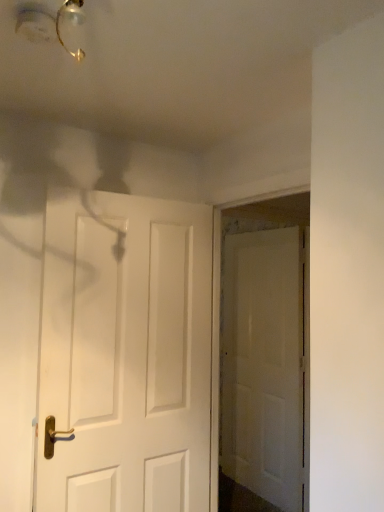
What do you see at coordinates (126, 354) in the screenshot?
I see `white matte door at center, marked as the first door in a front-to-back arrangement` at bounding box center [126, 354].

Where is `white matte door at center, the 2th door from the front`? This screenshot has height=512, width=384. white matte door at center, the 2th door from the front is located at coordinates (263, 365).

Can we say white matte door at center, which is the 1th door in right-to-left order, lies outside matte gold light fixture at upper left?

Yes, white matte door at center, which is the 1th door in right-to-left order, is located beyond the bounds of matte gold light fixture at upper left.

From a real-world perspective, who is located lower, white matte door at center, which is the 1th door in right-to-left order, or matte gold light fixture at upper left?

white matte door at center, which is the 1th door in right-to-left order, is physically lower.

Are white matte door at center, placed as the first door when sorted from back to front, and matte gold light fixture at upper left beside each other?

They are not placed beside each other.

Is matte gold light fixture at upper left at the back of white matte door at center, arranged as the 2th door when viewed from the left?

No, white matte door at center, arranged as the 2th door when viewed from the left, is not facing the opposite direction of matte gold light fixture at upper left.

Is white matte door at center, acting as the first door starting from the left, facing away from matte gold light fixture at upper left?

No.

From the image's perspective, would you say white matte door at center, the second door positioned from the back, is shown under matte gold light fixture at upper left?

Yes, from the image's perspective, white matte door at center, the second door positioned from the back, is below matte gold light fixture at upper left.

Which object is wider, white matte door at center, marked as the first door in a front-to-back arrangement, or matte gold light fixture at upper left?

With larger width is white matte door at center, marked as the first door in a front-to-back arrangement.

Does point (91, 347) appear closer or farther from the camera than point (32, 2)?

Point (91, 347).

Is white matte door at center, which is the 1th door in right-to-left order, not close to white matte door at center, marked as the first door in a front-to-back arrangement?

Yes, white matte door at center, which is the 1th door in right-to-left order, is far from white matte door at center, marked as the first door in a front-to-back arrangement.

In order to click on door behind the white matte door at center, marked as the first door in a front-to-back arrangement in this screenshot , I will do `click(263, 365)`.

From the picture: Could you tell me if white matte door at center, which is the 1th door in right-to-left order, is facing white matte door at center, marked as the first door in a front-to-back arrangement?

Yes, white matte door at center, which is the 1th door in right-to-left order, is aimed at white matte door at center, marked as the first door in a front-to-back arrangement.

In the scene shown: From a real-world perspective, who is located lower, white matte door at center, placed as the first door when sorted from back to front, or white matte door at center, acting as the first door starting from the left?

white matte door at center, placed as the first door when sorted from back to front.

Measure the distance between matte gold light fixture at upper left and white matte door at center, marked as the first door in a front-to-back arrangement.

The distance of matte gold light fixture at upper left from white matte door at center, marked as the first door in a front-to-back arrangement, is 3.92 feet.

Is matte gold light fixture at upper left completely or partially outside of white matte door at center, the 2th door in the right-to-left sequence?

Yes, matte gold light fixture at upper left is outside of white matte door at center, the 2th door in the right-to-left sequence.

Is matte gold light fixture at upper left looking in the opposite direction of white matte door at center, the second door positioned from the back?

No.

Which is in front, point (22, 15) or point (79, 424)?

The point (22, 15) is in front.

Is white matte door at center, the 2th door in the right-to-left sequence, oriented away from white matte door at center, which is the 1th door in right-to-left order?

No, white matte door at center, the 2th door in the right-to-left sequence, is not facing the opposite direction of white matte door at center, which is the 1th door in right-to-left order.

Considering the relative sizes of white matte door at center, the second door positioned from the back, and white matte door at center, placed as the first door when sorted from back to front, in the image provided, is white matte door at center, the second door positioned from the back, wider than white matte door at center, placed as the first door when sorted from back to front,?

Correct, the width of white matte door at center, the second door positioned from the back, exceeds that of white matte door at center, placed as the first door when sorted from back to front.

Does white matte door at center, marked as the first door in a front-to-back arrangement, contain white matte door at center, placed as the first door when sorted from back to front?

No, white matte door at center, placed as the first door when sorted from back to front, is not a part of white matte door at center, marked as the first door in a front-to-back arrangement.

Could you measure the distance between matte gold light fixture at upper left and white matte door at center, the 2th door from the front?

8.20 feet.

What's the angular difference between matte gold light fixture at upper left and white matte door at center, arranged as the 2th door when viewed from the left,'s facing directions?

180 degrees separate the facing orientations of matte gold light fixture at upper left and white matte door at center, arranged as the 2th door when viewed from the left.

Looking at this image, considering the relative positions of matte gold light fixture at upper left and white matte door at center, placed as the first door when sorted from back to front, in the image provided, is matte gold light fixture at upper left to the left or to the right of white matte door at center, placed as the first door when sorted from back to front,?

From the image, it's evident that matte gold light fixture at upper left is to the left of white matte door at center, placed as the first door when sorted from back to front.

Identify the location of door that is the 2nd one below the matte gold light fixture at upper left (from a real-world perspective). (263, 365).

From the matte gold light fixture at upper left, count 2nd door to the right and point to it. Please provide its 2D coordinates.

[(263, 365)]

Locate an element on the screen. light fixture above the white matte door at center, the 2th door in the right-to-left sequence (from the image's perspective) is located at coordinates (50, 23).

From the image, which object appears to be farther from matte gold light fixture at upper left, white matte door at center, the 2th door from the front, or white matte door at center, the 2th door in the right-to-left sequence?

white matte door at center, the 2th door from the front, lies further to matte gold light fixture at upper left than the other object.

From the image, which object appears to be nearer to white matte door at center, marked as the first door in a front-to-back arrangement, white matte door at center, placed as the first door when sorted from back to front, or matte gold light fixture at upper left?

matte gold light fixture at upper left.

Estimate the real-world distances between objects in this image. Which object is closer to white matte door at center, marked as the first door in a front-to-back arrangement, matte gold light fixture at upper left or white matte door at center, the 2th door from the front?

matte gold light fixture at upper left is closer to white matte door at center, marked as the first door in a front-to-back arrangement.

Based on their spatial positions, is matte gold light fixture at upper left or white matte door at center, the 2th door in the right-to-left sequence, further from white matte door at center, which is the 1th door in right-to-left order?

matte gold light fixture at upper left.

Considering their positions, is white matte door at center, the second door positioned from the back, positioned further to matte gold light fixture at upper left than white matte door at center, the 2th door from the front?

Among the two, white matte door at center, the 2th door from the front, is located further to matte gold light fixture at upper left.

Which object lies further to the anchor point white matte door at center, which is the 1th door in right-to-left order, white matte door at center, the second door positioned from the back, or matte gold light fixture at upper left?

matte gold light fixture at upper left is further to white matte door at center, which is the 1th door in right-to-left order.

In order to click on door between matte gold light fixture at upper left and white matte door at center, arranged as the 2th door when viewed from the left, along the z-axis in this screenshot , I will do `click(126, 354)`.